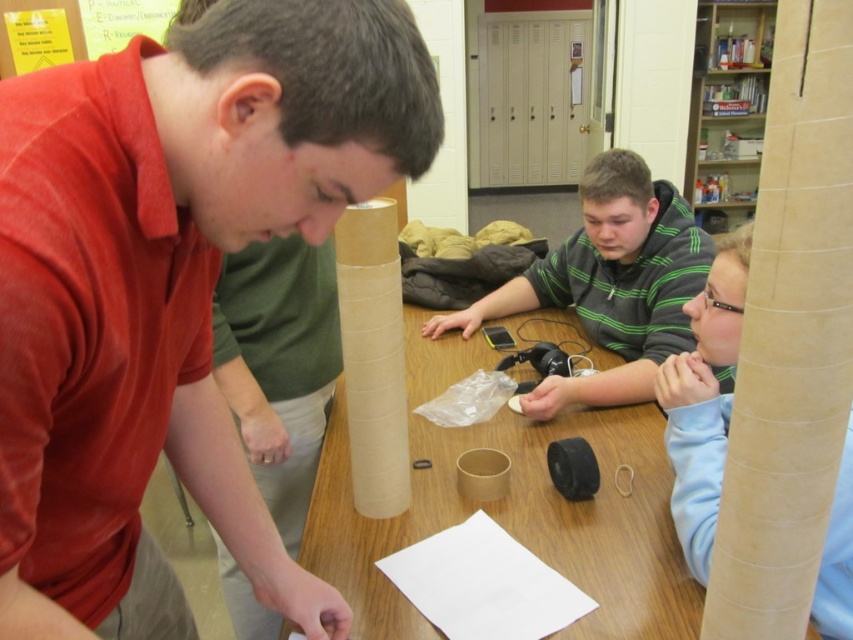
You are a student in the classroom and need to place a small object on the table. The object must be placed on top of the transparent plastic bag at center. Can you place it there without moving the matte cardboard tube at right?

The matte cardboard tube at right is located below the transparent plastic bag at center, so yes, you can place the small object on top of the transparent plastic bag at center without moving the matte cardboard tube at right since it is underneath.

What are the coordinates of the brown cardboard table at center?

Answer: The brown cardboard table at center is located at coordinates point (509, 508).

You are a student in the classroom and need to choose between the matte cardboard tube at right and the transparent plastic bag at center to store a long poster. Which object is better suited for this task and why?

The matte cardboard tube at right is much taller than the transparent plastic bag at center, making it better suited for storing a long poster as it can accommodate the poster without folding or creasing.